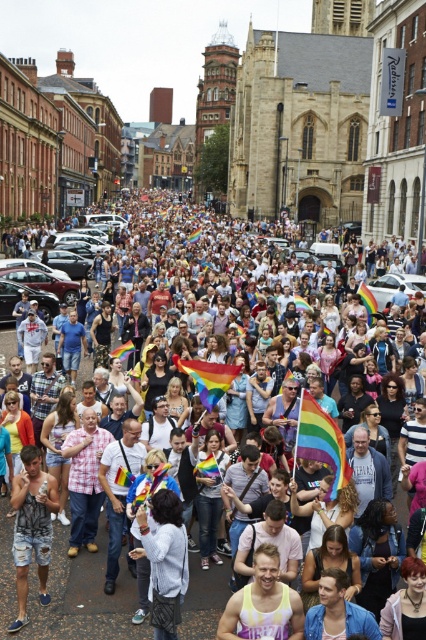
You are a photographer standing in the crowd at the event. You want to take a photo that includes both the point at coordinates point (x=51, y=508) and point (x=143, y=547). Which point should you focus on first to ensure both are in focus?

You should focus on point (x=51, y=508) first because it is closer to the camera than point (x=143, y=547). This ensures the closer point is in focus, and the further point may also be within the depth of field.